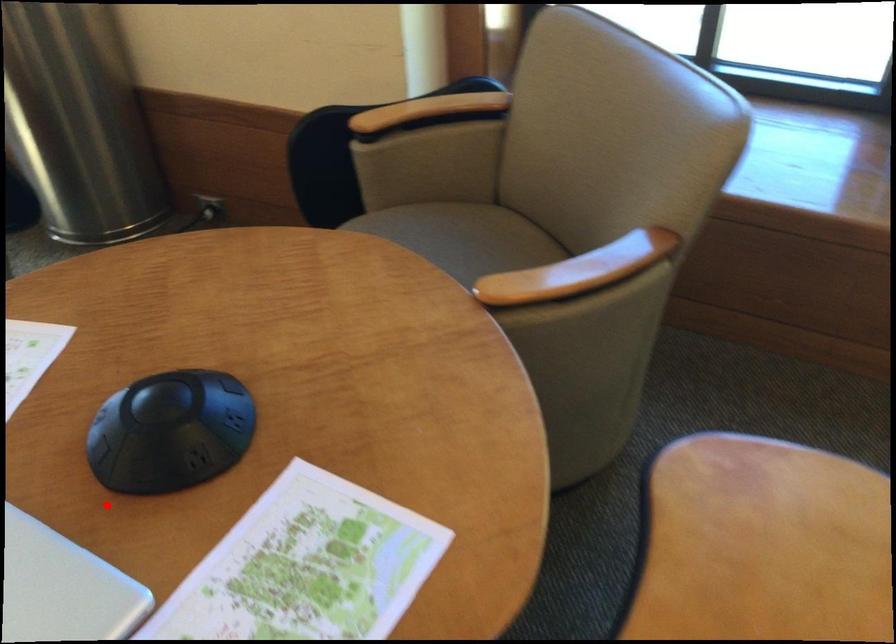
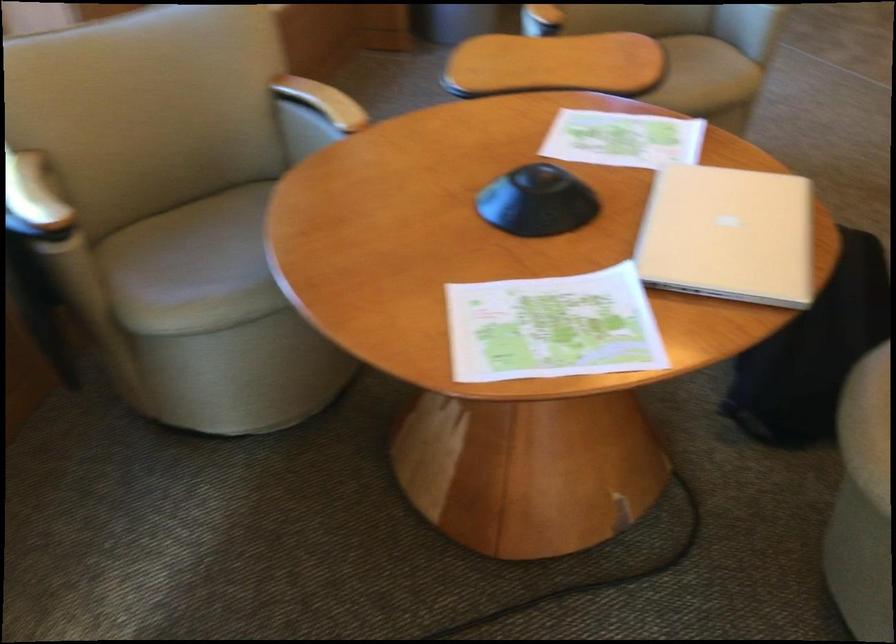
Question: I am providing you with two images of the same scene from different viewpoints. Given a red point in image1, look at the same physical point in image2. Is it:

Choices:
 (A) Closer to the viewpoint
 (B) Farther from the viewpoint

Answer: (B)